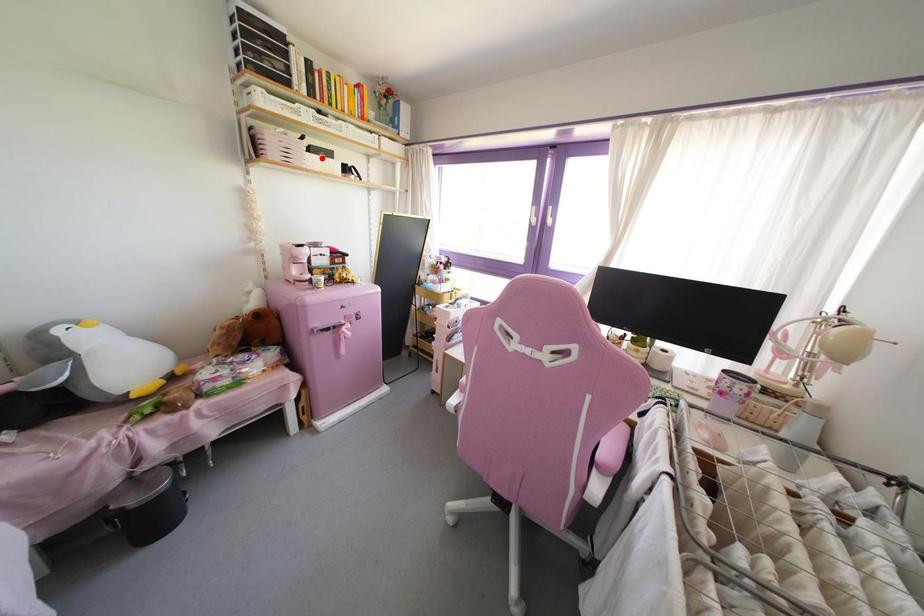
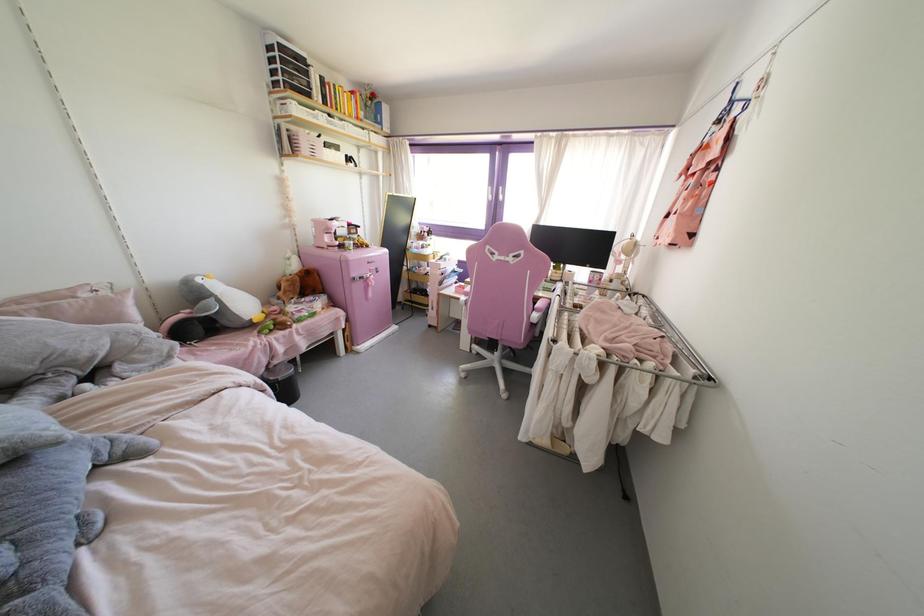
The point at the highlighted location is marked in the first image. Where is the corresponding point in the second image?

(333, 151)